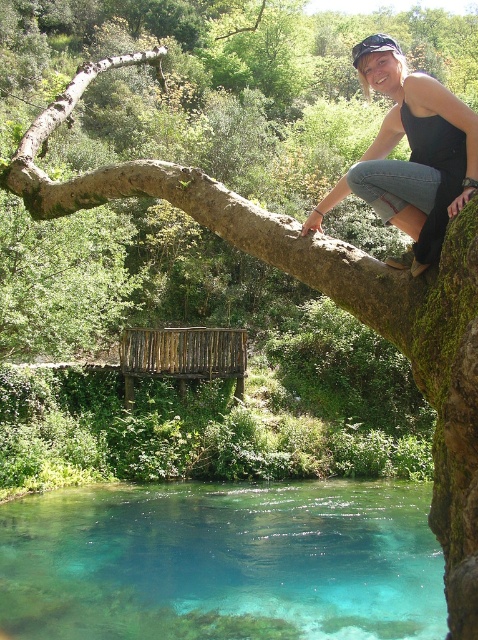
Question: Which of the following is the farthest from the observer?

Choices:
 (A) (158, 534)
 (B) (456, 163)

Answer: (A)

Question: Can you confirm if clear glassy water at lower center is positioned to the right of black denim jeans at upper right?

Choices:
 (A) no
 (B) yes

Answer: (A)

Question: Does clear glassy water at lower center come in front of black denim jeans at upper right?

Choices:
 (A) no
 (B) yes

Answer: (A)

Question: Where is clear glassy water at lower center located in relation to black denim jeans at upper right in the image?

Choices:
 (A) right
 (B) left

Answer: (B)